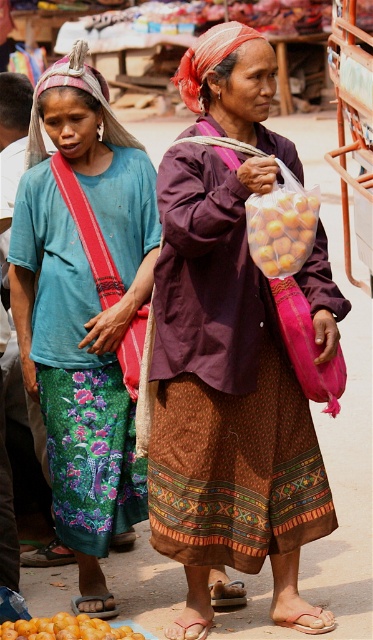
Question: Among these points, which one is farthest from the camera?

Choices:
 (A) (286, 246)
 (B) (39, 625)
 (C) (170, 240)

Answer: (B)

Question: Among these points, which one is farthest from the camera?

Choices:
 (A) (77, 387)
 (B) (280, 200)

Answer: (A)

Question: Can you confirm if matte purple blouse at center is positioned above matte blue shirt at center?

Choices:
 (A) yes
 (B) no

Answer: (B)

Question: From the image, what is the correct spatial relationship of matte purple blouse at center in relation to orange matte fruit at lower left?

Choices:
 (A) right
 (B) left

Answer: (A)

Question: Can you confirm if matte purple blouse at center is positioned to the right of orange matte fruit at lower left?

Choices:
 (A) no
 (B) yes

Answer: (B)

Question: Which object appears closest to the camera in this image?

Choices:
 (A) matte blue shirt at center
 (B) yellow matte dried fruit at center
 (C) orange matte fruit at lower left

Answer: (B)